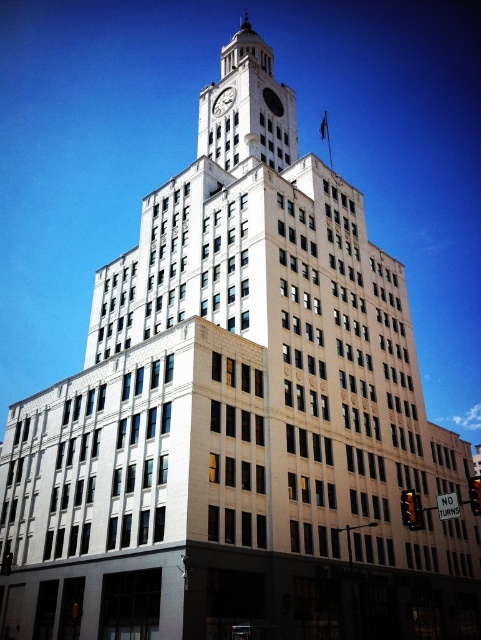
You are standing in front of a building and see the point at coordinates (x=249, y=108). Based on the scene description, what architectural feature is located at that point?

The point at coordinates (x=249, y=108) indicates the white stone clock tower at center.

You are an architect analyzing the building structure. You notice the white stone clock tower at center and the white marble clock at upper center. Which one is closer to the observer?

The white stone clock tower at center is closer to the observer than the white marble clock at upper center because it is positioned in front of it.

You are an architect analyzing the building structure. Based on the image, which object is taller between the white stone clock tower at center and the white marble clock at upper center?

The white stone clock tower at center is taller than the white marble clock at upper center according to the description.